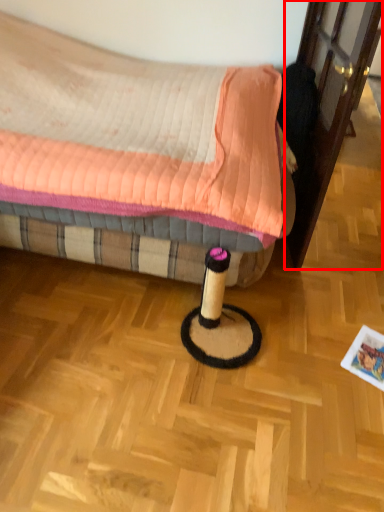
Question: Considering the relative positions of screen door (annotated by the red box) and bed in the image provided, where is screen door (annotated by the red box) located with respect to the staircase?

Choices:
 (A) right
 (B) left

Answer: (A)